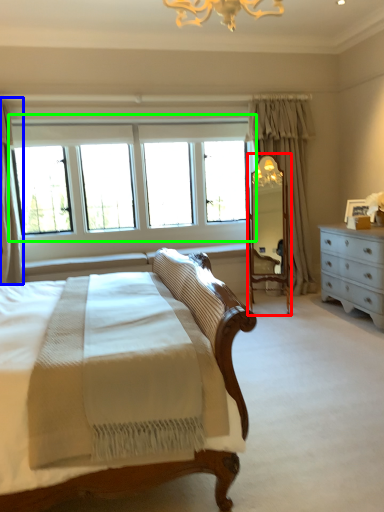
Question: Estimate the real-world distances between objects in this image. Which object is farther from mirror (highlighted by a red box), curtain (highlighted by a blue box) or window (highlighted by a green box)?

Choices:
 (A) curtain
 (B) window

Answer: (A)